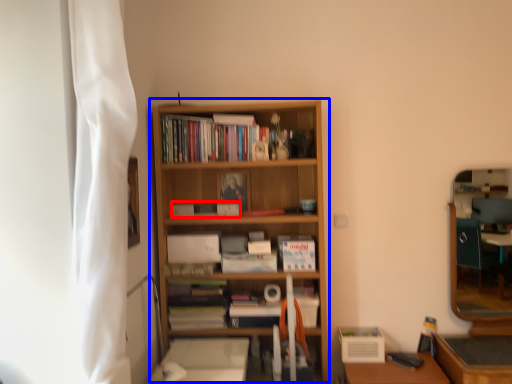
Question: Which object appears farthest to the camera in this image, paperback book (highlighted by a red box) or bookcase (highlighted by a blue box)?

Choices:
 (A) paperback book
 (B) bookcase

Answer: (A)